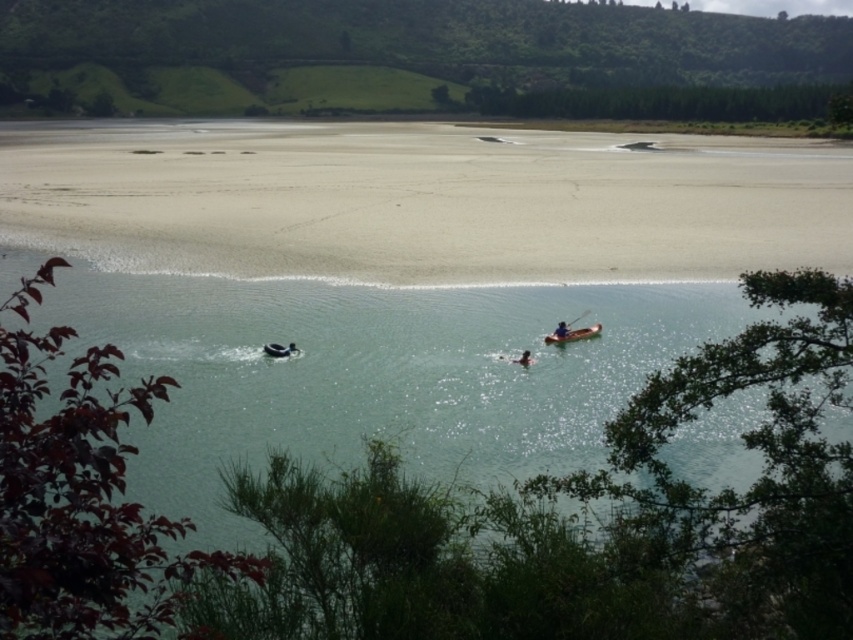
Question: Which of the following is the farthest from the observer?

Choices:
 (A) (296, 252)
 (B) (292, 342)
 (C) (599, 323)

Answer: (A)

Question: Is clear water at center to the left of sandy shore at lower center from the viewer's perspective?

Choices:
 (A) no
 (B) yes

Answer: (B)

Question: Based on their relative distances, which object is nearer to the blue fabric kayak at center?

Choices:
 (A) wooden canoe at center
 (B) sandy shore at lower center
 (C) black rubber ring at lower center
 (D) clear water at center

Answer: (A)

Question: Which object appears farthest from the camera in this image?

Choices:
 (A) sandy shore at lower center
 (B) black rubber ring at lower center
 (C) blue fabric kayak at center

Answer: (A)

Question: Can you confirm if clear water at center is wider than wooden canoe at center?

Choices:
 (A) yes
 (B) no

Answer: (A)

Question: Is sandy shore at lower center positioned behind black rubber ring at lower center?

Choices:
 (A) yes
 (B) no

Answer: (A)